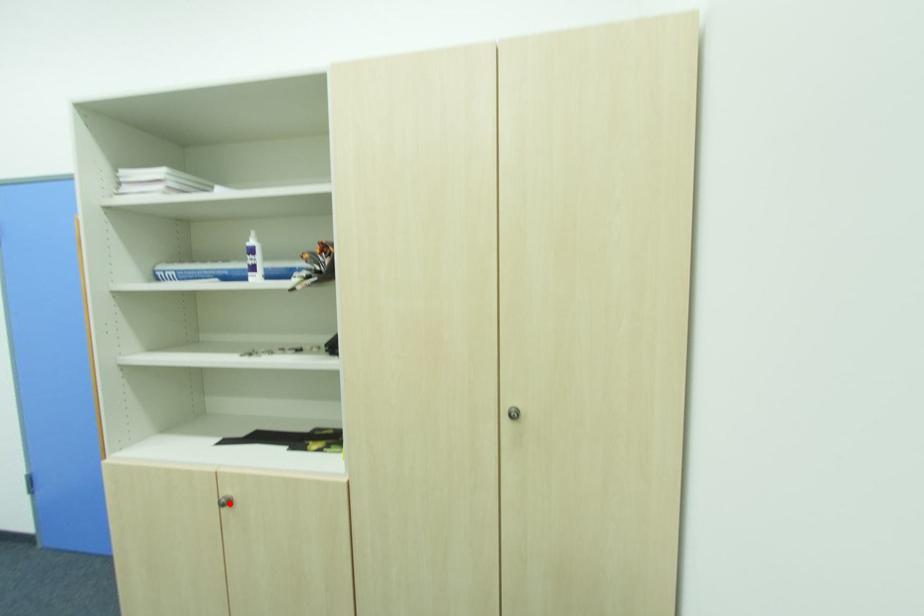
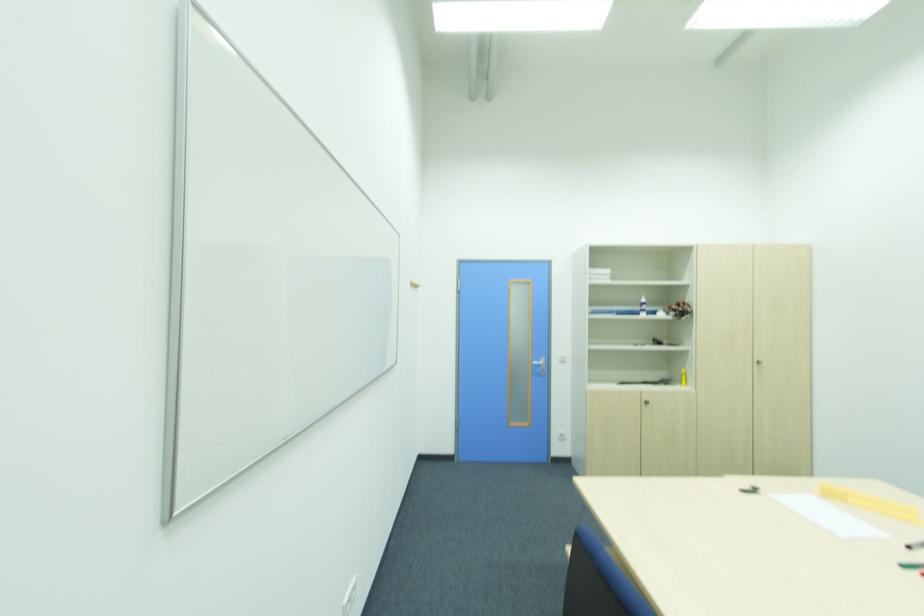
The point at the highlighted location is marked in the first image. Where is the corresponding point in the second image?

(650, 402)